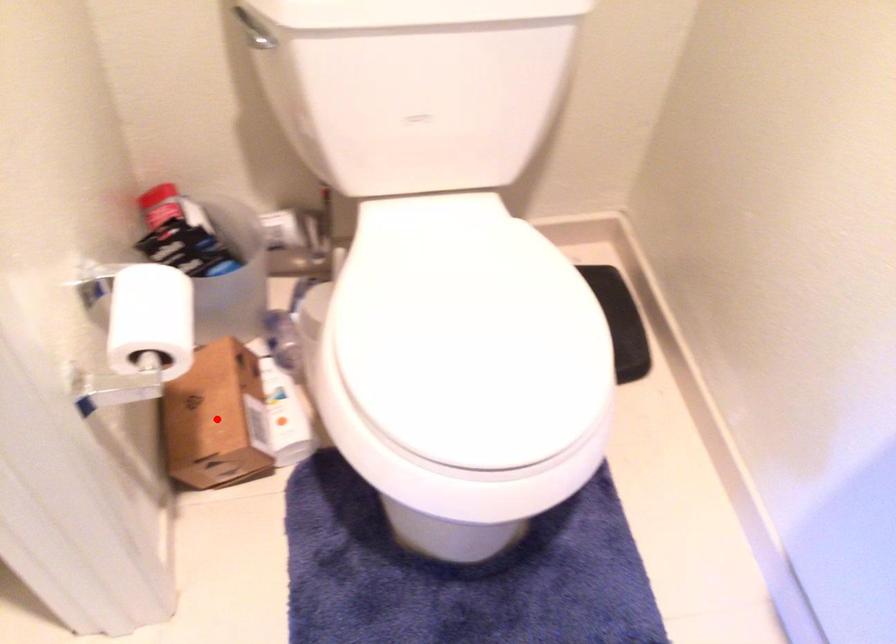
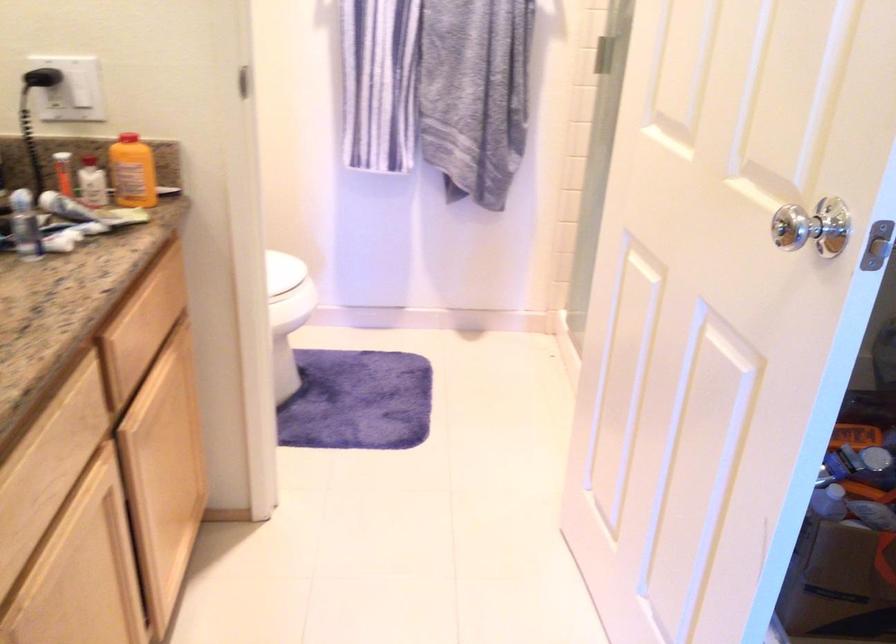
Question: I am providing you with two images of the same scene from different viewpoints. A red point is marked on the first image. Can you still see the location of the red point in image 2?

Choices:
 (A) Yes
 (B) No

Answer: (B)